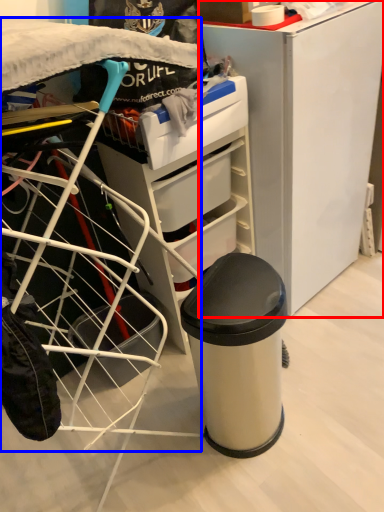
Question: Which point is closer to the camera, furniture (highlighted by a red box) or wide (highlighted by a blue box)?

Choices:
 (A) furniture
 (B) wide

Answer: (B)